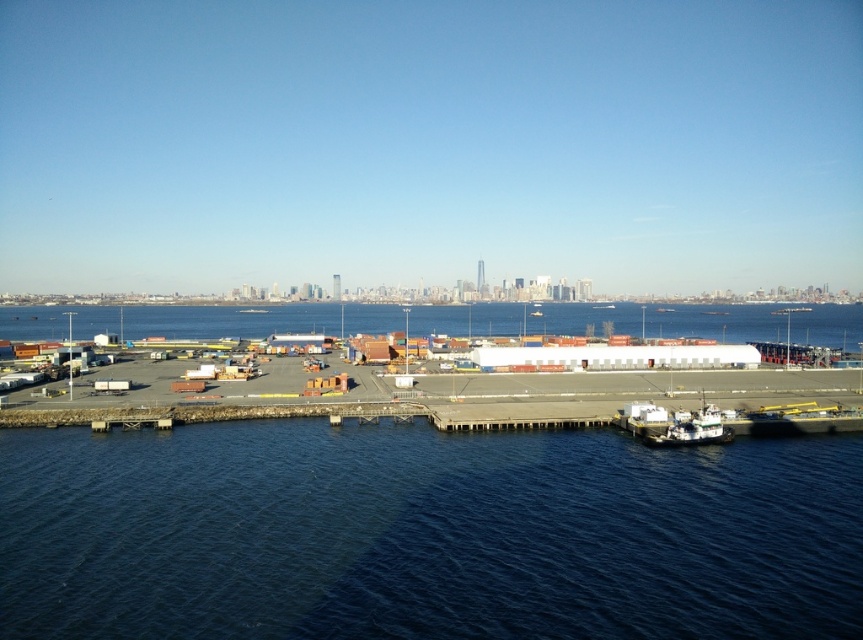
Which is more to the right, dark blue water at lower center or white matte boat at lower right?

white matte boat at lower right is more to the right.

Is dark blue water at lower center shorter than white matte boat at lower right?

Indeed, dark blue water at lower center has a lesser height compared to white matte boat at lower right.

The width and height of the screenshot is (863, 640). In order to click on dark blue water at lower center in this screenshot , I will do `click(424, 536)`.

Locate an element on the screen. This screenshot has height=640, width=863. dark blue water at lower center is located at coordinates (424, 536).